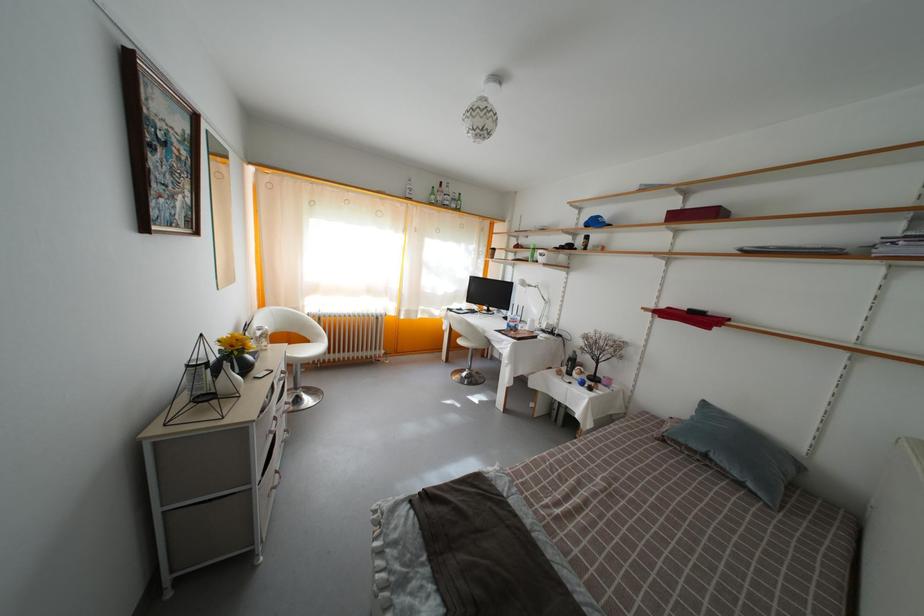
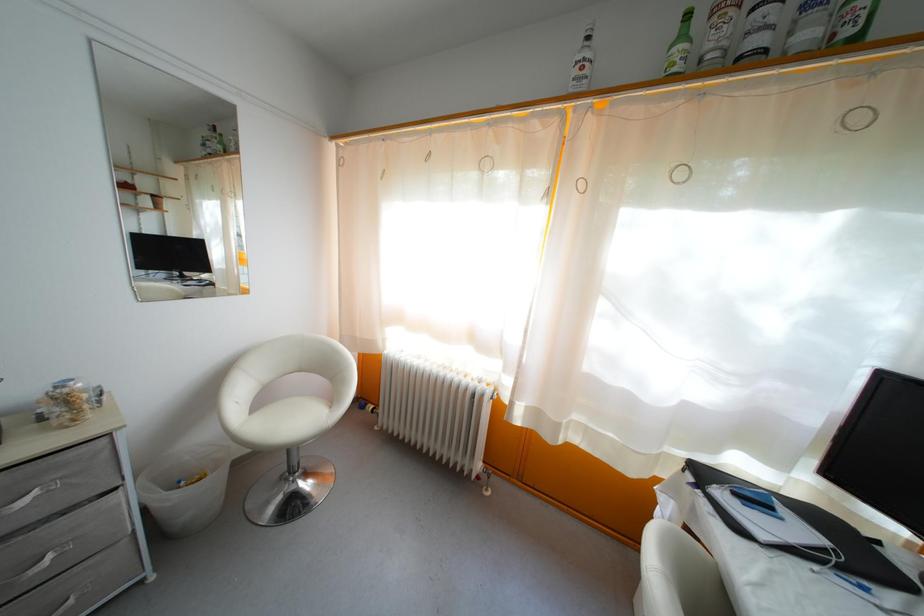
Locate, in the second image, the point that corresponds to point 310,403 in the first image.

(282, 505)